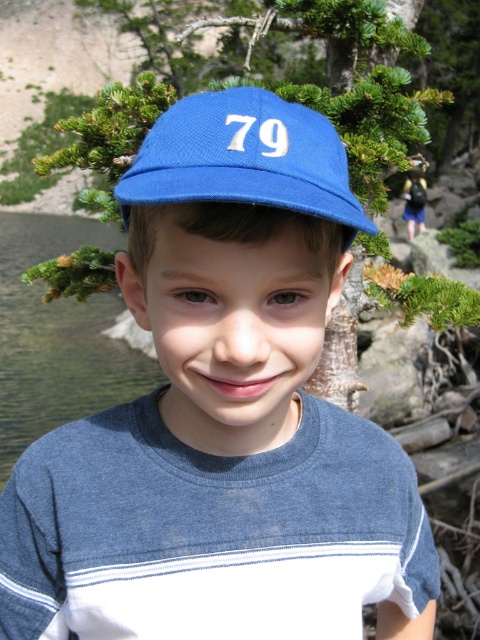
Question: Which point is closer to the camera?

Choices:
 (A) blue fabric baseball cap at center
 (B) clear water at lake left
 (C) green leafy branches at upper center

Answer: (A)

Question: Is green leafy branches at upper center positioned in front of blue fabric baseball cap at center?

Choices:
 (A) no
 (B) yes

Answer: (A)

Question: Can you confirm if green leafy branches at upper center is bigger than blue fabric baseball cap at center?

Choices:
 (A) yes
 (B) no

Answer: (A)

Question: Which object appears closest to the camera in this image?

Choices:
 (A) green leafy branches at upper center
 (B) clear water at lake left
 (C) blue fabric baseball cap at center

Answer: (C)

Question: Which of these objects is positioned farthest from the green leafy branches at upper center?

Choices:
 (A) blue fabric baseball cap at center
 (B) clear water at lake left

Answer: (B)

Question: Does green leafy branches at upper center appear on the right side of blue fabric baseball cap at center?

Choices:
 (A) yes
 (B) no

Answer: (A)